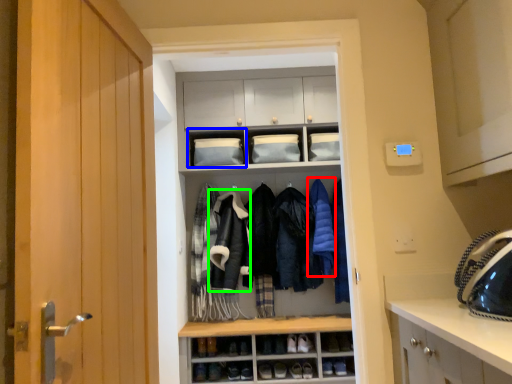
Question: Considering the real-world distances, which object is farthest from clothing (highlighted by a red box)? cabinet (highlighted by a blue box) or sweatshirt (highlighted by a green box)?

Choices:
 (A) cabinet
 (B) sweatshirt

Answer: (A)